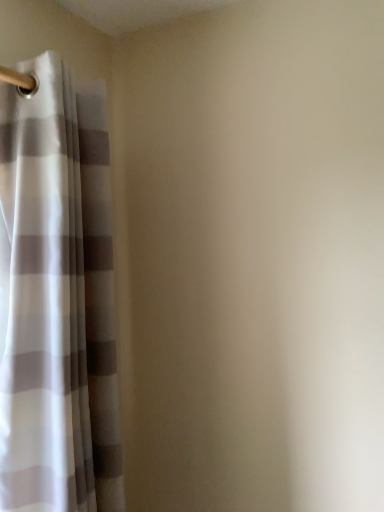
Image resolution: width=384 pixels, height=512 pixels. Describe the element at coordinates (56, 298) in the screenshot. I see `translucent white and gray striped curtain at left` at that location.

The height and width of the screenshot is (512, 384). What are the coordinates of `translucent white and gray striped curtain at left` in the screenshot? It's located at pos(56,298).

This screenshot has height=512, width=384. Identify the location of translucent white and gray striped curtain at left. (56, 298).